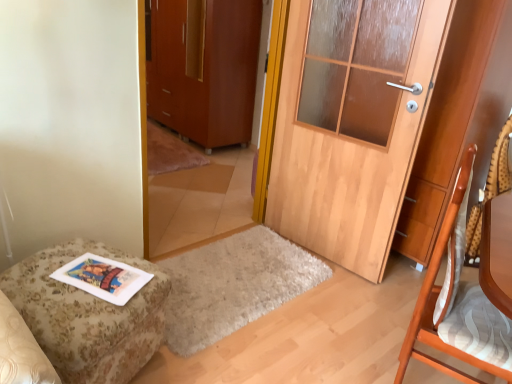
Find the location of a particular element. This screenshot has width=512, height=384. wooden chair at right is located at coordinates (466, 294).

What do you see at coordinates (490, 191) in the screenshot? I see `wooden textured swivel chair at right` at bounding box center [490, 191].

Where is `floral fabric ottoman at lower left`? The image size is (512, 384). floral fabric ottoman at lower left is located at coordinates (88, 315).

Where is `wooden chair at right`? Image resolution: width=512 pixels, height=384 pixels. wooden chair at right is located at coordinates (466, 294).

Does floral fabric ottoman at lower left have a greater height compared to wooden chair at right?

In fact, floral fabric ottoman at lower left may be shorter than wooden chair at right.

Is floral fabric ottoman at lower left bigger than wooden chair at right?

Incorrect, floral fabric ottoman at lower left is not larger than wooden chair at right.

Is the surface of floral fabric ottoman at lower left in direct contact with wooden chair at right?

There is a gap between floral fabric ottoman at lower left and wooden chair at right.

Based on the photo, is floral fabric ottoman at lower left turned away from wooden chair at right?

No, floral fabric ottoman at lower left is not facing away from wooden chair at right.

Between floral fabric ottoman at lower left and wooden textured swivel chair at right, which one appears on the left side from the viewer's perspective?

floral fabric ottoman at lower left.

Considering the relative sizes of floral fabric ottoman at lower left and wooden textured swivel chair at right in the image provided, is floral fabric ottoman at lower left bigger than wooden textured swivel chair at right?

Indeed, floral fabric ottoman at lower left has a larger size compared to wooden textured swivel chair at right.

Is floral fabric ottoman at lower left in front of wooden textured swivel chair at right?

That is True.

Where is `swivel chair that is above the floral fabric ottoman at lower left (from a real-world perspective)`? The height and width of the screenshot is (384, 512). swivel chair that is above the floral fabric ottoman at lower left (from a real-world perspective) is located at coordinates (490, 191).

From a real-world perspective, does wooden door at center sit lower than floral fabric ottoman at lower left?

Actually, wooden door at center is physically above floral fabric ottoman at lower left in the real world.

Based on the photo, which of these two, wooden door at center or floral fabric ottoman at lower left, is thinner?

With smaller width is wooden door at center.

Is wooden door at center to the left or to the right of floral fabric ottoman at lower left in the image?

wooden door at center is to the right of floral fabric ottoman at lower left.

Can you confirm if floral fabric ottoman at lower left is smaller than matte brown cabinet at center?

Yes.

Does floral fabric ottoman at lower left lie behind matte brown cabinet at center?

No, it is not.

Is floral fabric ottoman at lower left surrounding matte brown cabinet at center?

Definitely not — matte brown cabinet at center is not inside floral fabric ottoman at lower left.

Considering the sizes of floral fabric ottoman at lower left and matte brown cabinet at center in the image, is floral fabric ottoman at lower left wider or thinner than matte brown cabinet at center?

Clearly, floral fabric ottoman at lower left has less width compared to matte brown cabinet at center.

From the picture: Is wooden door at center not close to wooden chair at right?

No, wooden door at center is not far away from wooden chair at right.

Who is smaller, wooden door at center or wooden chair at right?

wooden chair at right is smaller.

Is wooden door at center oriented away from wooden chair at right?

No, wooden door at center's orientation is not away from wooden chair at right.

From the image's perspective, which is above, wooden door at center or wooden chair at right?

From the image's view, wooden door at center is above.

Could you tell me if wooden chair at right is turned towards floral fabric ottoman at lower left?

No.

Is wooden chair at right taller than floral fabric ottoman at lower left?

Correct, wooden chair at right is much taller as floral fabric ottoman at lower left.

From a real-world perspective, is wooden chair at right physically below floral fabric ottoman at lower left?

Actually, wooden chair at right is physically above floral fabric ottoman at lower left in the real world.

Does point (100, 248) appear closer or farther from the camera than point (342, 21)?

Point (100, 248) is positioned closer to the camera compared to point (342, 21).

Is floral fabric ottoman at lower left placed right next to wooden door at center?

No.

Which object is positioned more to the right, floral fabric ottoman at lower left or wooden door at center?

From the viewer's perspective, wooden door at center appears more on the right side.

From a real-world perspective, is floral fabric ottoman at lower left on wooden door at center?

No, from a real-world perspective, floral fabric ottoman at lower left is not above wooden door at center.

The height and width of the screenshot is (384, 512). Identify the location of furniture that appears behind the wooden chair at right. (88, 315).

Image resolution: width=512 pixels, height=384 pixels. I want to click on swivel chair above the floral fabric ottoman at lower left (from the image's perspective), so click(490, 191).

Looking at the image, which one is located further to matte brown cabinet at center, wooden chair at right or floral fabric ottoman at lower left?

Based on the image, wooden chair at right appears to be further to matte brown cabinet at center.

Based on their spatial positions, is floral fabric ottoman at lower left or wooden textured swivel chair at right further from wooden chair at right?

Based on the image, wooden textured swivel chair at right appears to be further to wooden chair at right.

From the image, which object appears to be nearer to wooden textured swivel chair at right, wooden chair at right or matte brown cabinet at center?

wooden chair at right is closer to wooden textured swivel chair at right.

Considering their positions, is floral fabric ottoman at lower left positioned closer to matte brown cabinet at center than wooden chair at right?

floral fabric ottoman at lower left is positioned closer to the anchor matte brown cabinet at center.

Looking at the image, which one is located closer to matte brown cabinet at center, wooden textured swivel chair at right or wooden chair at right?

wooden textured swivel chair at right lies closer to matte brown cabinet at center than the other object.

Looking at the image, which one is located closer to matte brown cabinet at center, floral fabric ottoman at lower left or wooden textured swivel chair at right?

floral fabric ottoman at lower left is positioned closer to the anchor matte brown cabinet at center.

Which object lies nearer to the anchor point wooden chair at right, wooden textured swivel chair at right or floral fabric ottoman at lower left?

floral fabric ottoman at lower left.

Considering their positions, is wooden chair at right positioned further to matte brown cabinet at center than wooden textured swivel chair at right?

Among the two, wooden chair at right is located further to matte brown cabinet at center.

This screenshot has width=512, height=384. I want to click on chair situated between floral fabric ottoman at lower left and wooden textured swivel chair at right from left to right, so click(x=466, y=294).

The width and height of the screenshot is (512, 384). What are the coordinates of `swivel chair positioned between wooden chair at right and matte brown cabinet at center from near to far` in the screenshot? It's located at (x=490, y=191).

Locate an element on the screen. The width and height of the screenshot is (512, 384). door situated between floral fabric ottoman at lower left and wooden textured swivel chair at right from left to right is located at coordinates (352, 123).

This screenshot has height=384, width=512. In order to click on furniture between matte brown cabinet at center and wooden textured swivel chair at right from left to right in this screenshot , I will do `click(88, 315)`.